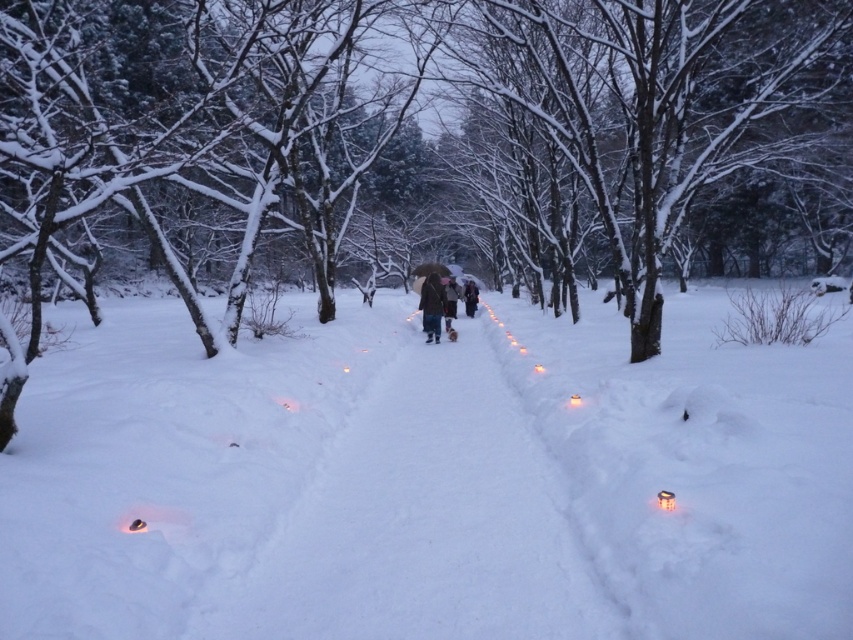
Question: Can you confirm if dark brown leather jacket at center is positioned to the right of dark gray wool coat at center?

Choices:
 (A) yes
 (B) no

Answer: (B)

Question: Does brown wool coat at center have a smaller size compared to brown woolen coat at center?

Choices:
 (A) yes
 (B) no

Answer: (B)

Question: Is brown woolen coat at center bigger than dark gray wool coat at center?

Choices:
 (A) no
 (B) yes

Answer: (A)

Question: Which object is farther from the camera taking this photo?

Choices:
 (A) white fluffy snow at center
 (B) brown wool coat at center
 (C) snow-covered tree at center

Answer: (B)

Question: Which point is farther from the camera taking this photo?

Choices:
 (A) (422, 324)
 (B) (469, 284)
 (C) (733, 150)

Answer: (B)

Question: Which point is farther to the camera?

Choices:
 (A) snow-covered tree at center
 (B) brown woolen coat at center
 (C) white fluffy snow at center
 (D) brown wool coat at center

Answer: (D)